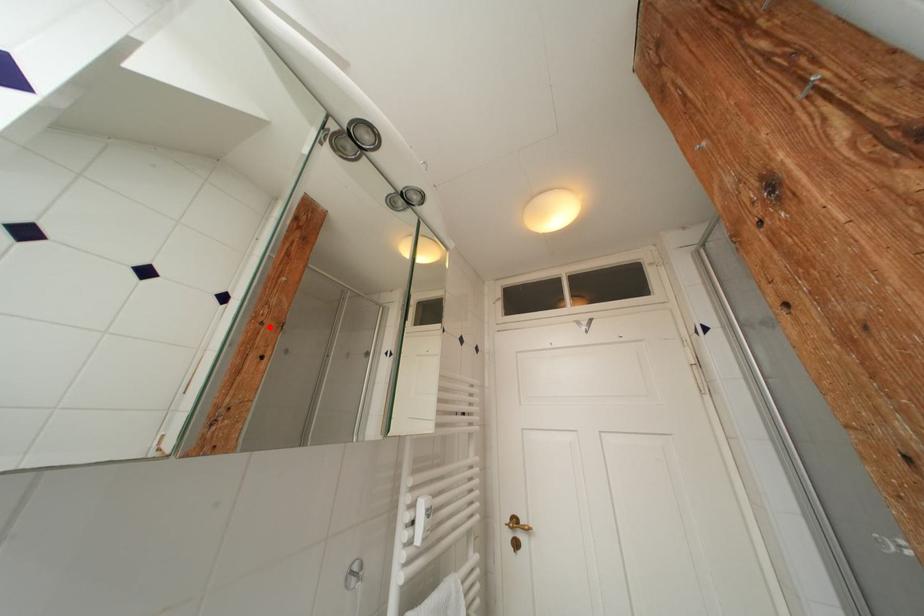
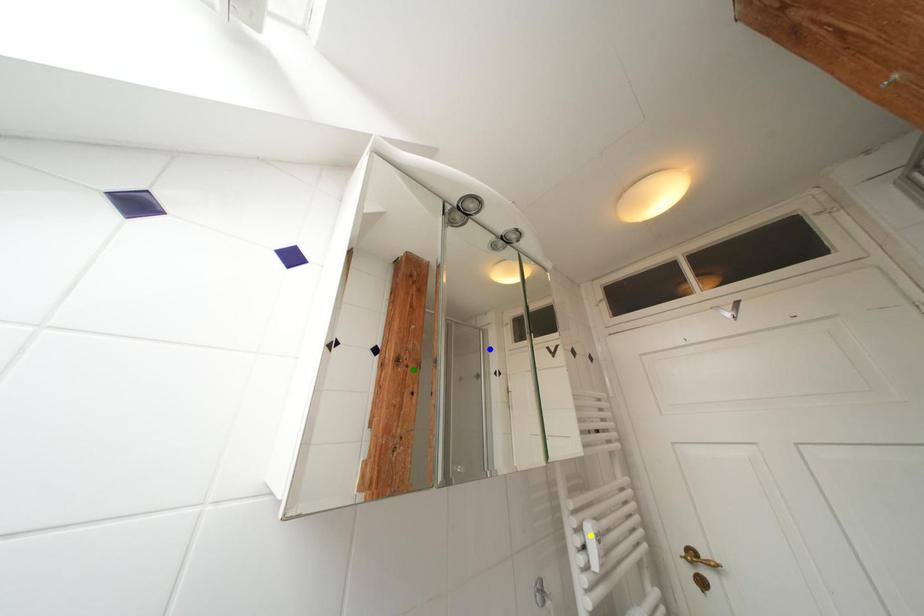
Question: I am providing you with two images of the same scene from different viewpoints. A red point is marked on the first image. You are given multiple points on the second image. Which mark in image 2 goes with the point in image 1?

Choices:
 (A) blue point
 (B) yellow point
 (C) green point

Answer: (C)